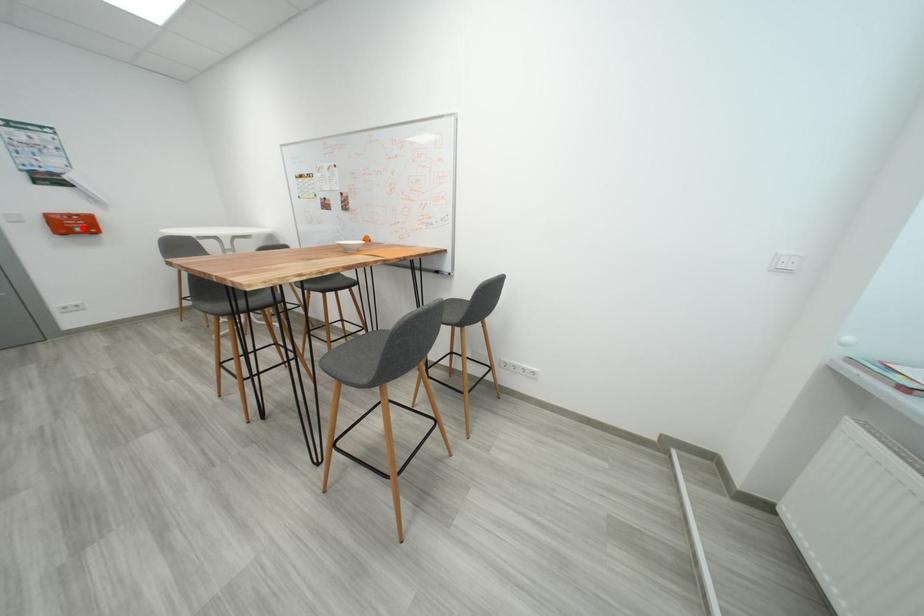
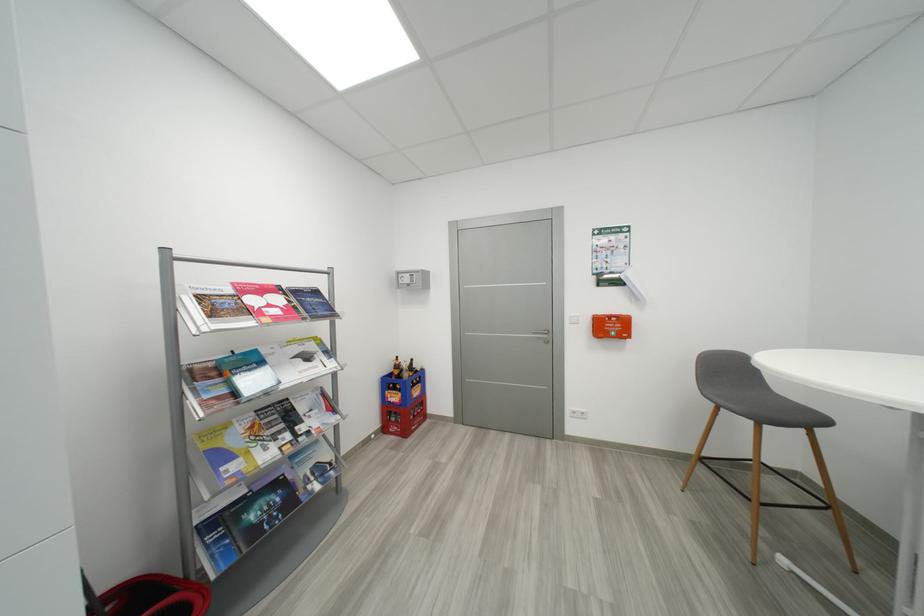
Find the pixel in the second image that matches the highlighted location in the first image.

(617, 330)